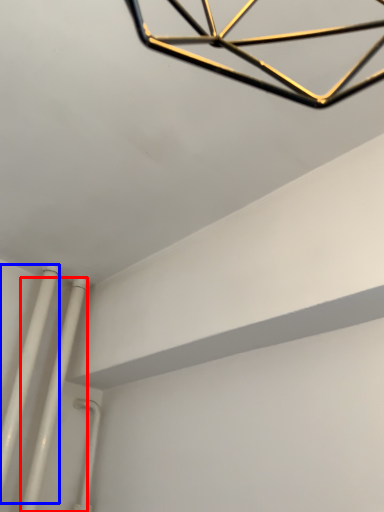
Question: Which object is closer to the camera taking this photo, pipe (highlighted by a red box) or pipe (highlighted by a blue box)?

Choices:
 (A) pipe
 (B) pipe

Answer: (B)